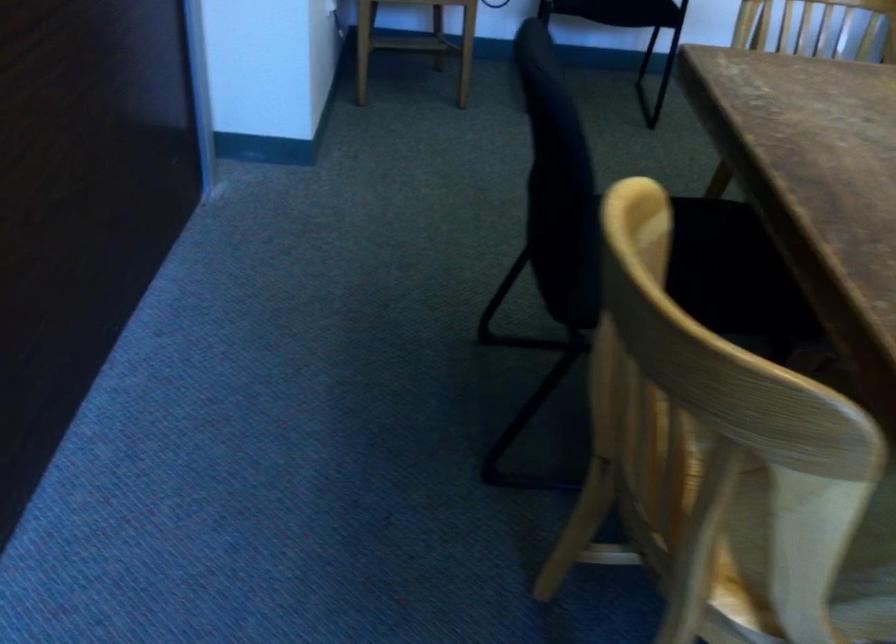
Image resolution: width=896 pixels, height=644 pixels. What do you see at coordinates (721, 260) in the screenshot? I see `the black chair sitting surface` at bounding box center [721, 260].